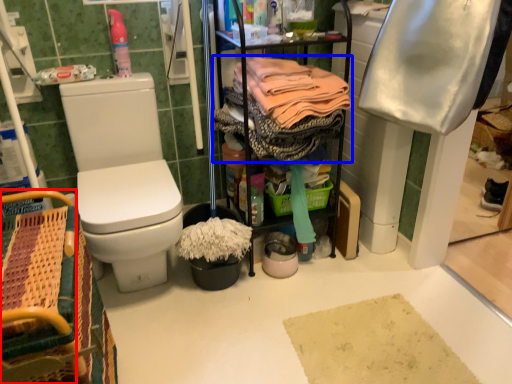
Question: Which object appears farthest to the camera in this image, picnic basket (highlighted by a red box) or clothing (highlighted by a blue box)?

Choices:
 (A) picnic basket
 (B) clothing

Answer: (B)